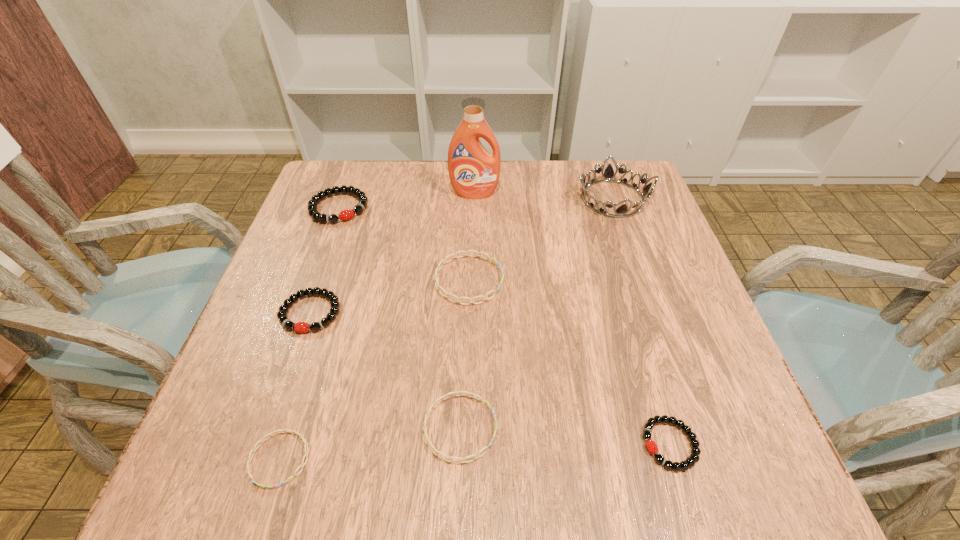
Find the location of a particular element. Image resolution: width=960 pixels, height=540 pixels. the tallest object is located at coordinates (474, 172).

The width and height of the screenshot is (960, 540). I want to click on tiara, so click(x=621, y=211).

I want to click on the farthest bracelet, so click(348, 214).

The height and width of the screenshot is (540, 960). What are the coordinates of `the farthest black bracelet` in the screenshot? It's located at (348, 214).

I want to click on the biggest blue bracelet, so click(x=493, y=259).

Image resolution: width=960 pixels, height=540 pixels. Find the location of `the second smallest black bracelet`. the second smallest black bracelet is located at coordinates (334, 304).

Where is `the second smallest blue bracelet`? The image size is (960, 540). the second smallest blue bracelet is located at coordinates (463, 460).

Identify the location of the smallest black bracelet. (651, 446).

Identify the location of the rightmost black bracelet. Image resolution: width=960 pixels, height=540 pixels. (651, 446).

Locate an element on the screen. the shortest bracelet is located at coordinates (301, 436).